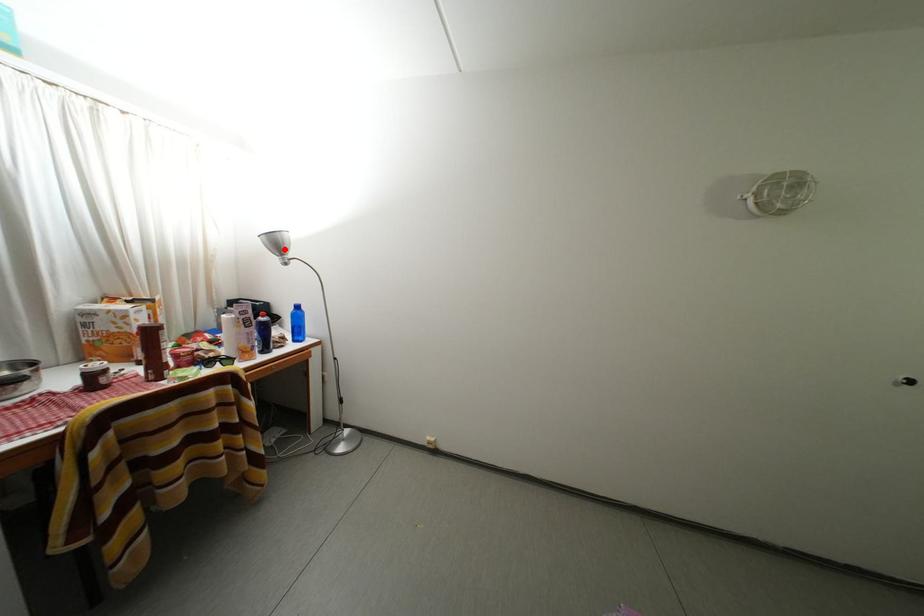
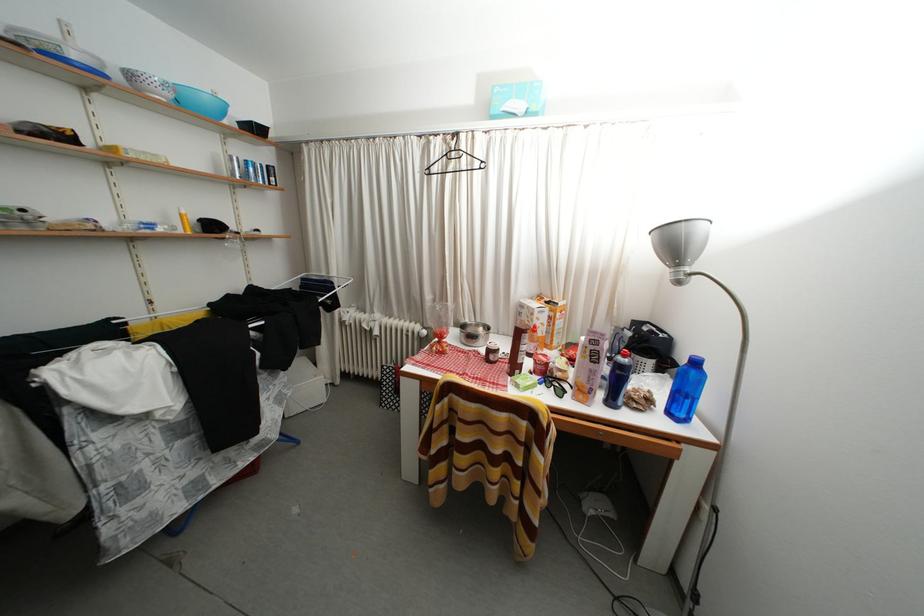
Locate, in the second image, the point that corresponds to the highlighted location in the first image.

(681, 251)